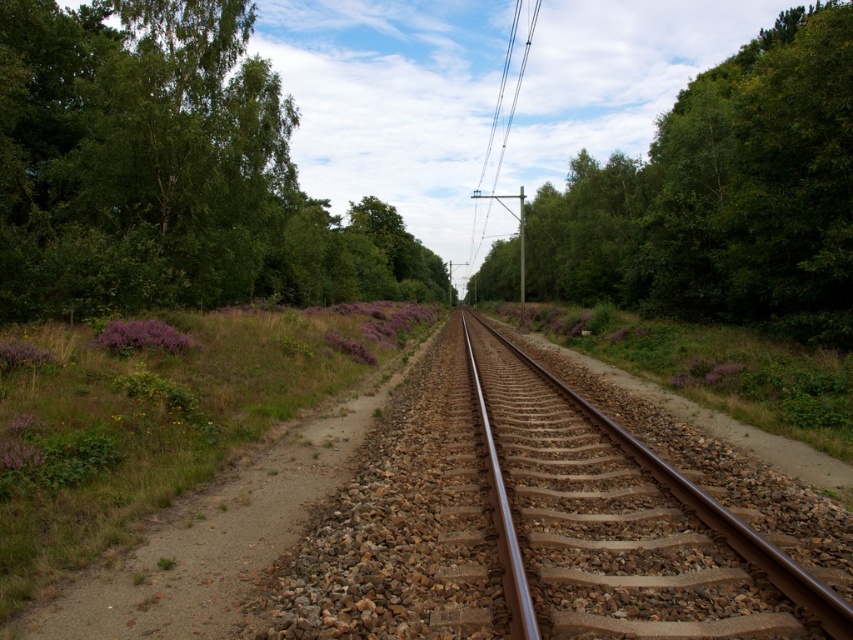
Question: Does green leafy tree at upper left have a larger size compared to green leafy tree at upper right?

Choices:
 (A) no
 (B) yes

Answer: (B)

Question: Which point appears farthest from the camera in this image?

Choices:
 (A) (82, 198)
 (B) (810, 8)
 (C) (585, 605)
 (D) (527, 8)

Answer: (D)

Question: Does green leafy tree at upper right appear on the left side of smooth wooden pole at center?

Choices:
 (A) no
 (B) yes

Answer: (A)

Question: Which of these objects is positioned farthest from the green leafy tree at upper left?

Choices:
 (A) brown metal track at center
 (B) green leafy tree at upper right

Answer: (A)

Question: Is brown metal track at center wider than smooth wooden pole at center?

Choices:
 (A) no
 (B) yes

Answer: (A)

Question: Which object appears closest to the camera in this image?

Choices:
 (A) green leafy tree at upper left
 (B) smooth wooden pole at center
 (C) green leafy tree at upper right
 (D) brown metal track at center

Answer: (D)